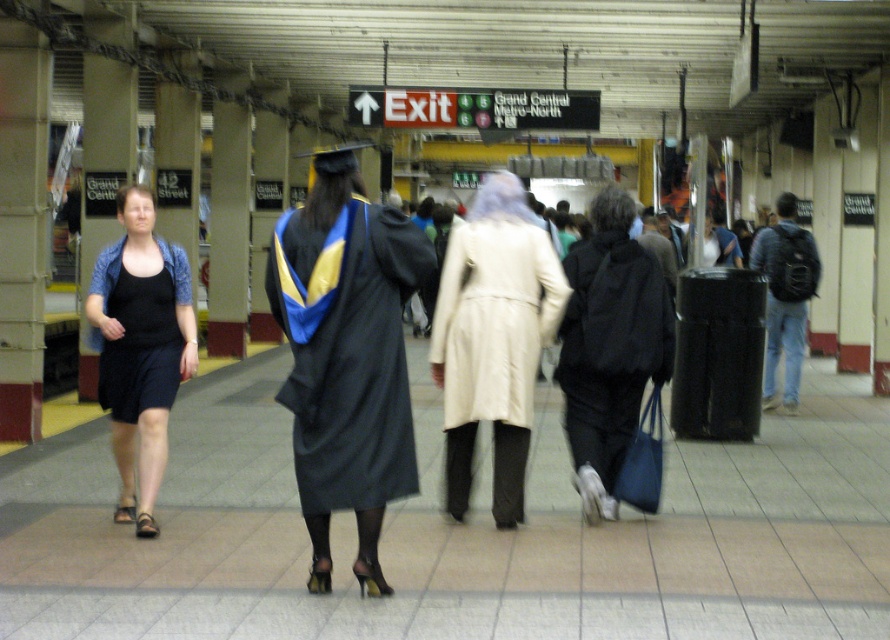
Question: From the image, what is the correct spatial relationship of black matte dress at center in relation to denim jeans at right?

Choices:
 (A) below
 (B) above

Answer: (A)

Question: Estimate the real-world distances between objects in this image. Which object is farther from the black matte dress at left?

Choices:
 (A) denim jeans at right
 (B) black matte dress at center
 (C) beige fabric coat at center

Answer: (A)

Question: Which point is farther to the camera?

Choices:
 (A) (816, 284)
 (B) (373, 240)
 (C) (540, 321)

Answer: (A)

Question: Is beige fabric coat at center smaller than black matte graduation gown at center?

Choices:
 (A) no
 (B) yes

Answer: (B)

Question: Does beige fabric coat at center have a smaller size compared to black matte graduation gown at center?

Choices:
 (A) no
 (B) yes

Answer: (B)

Question: Which object appears farthest from the camera in this image?

Choices:
 (A) beige fabric coat at center
 (B) black matte graduation gown at center
 (C) matte black gown at center
 (D) black matte dress at left

Answer: (B)